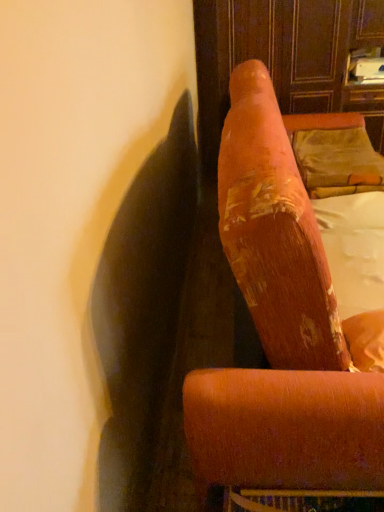
I want to click on white fabric at upper right, so click(354, 249).

From the image's perspective, who appears lower, velvet gold pillow at upper right or white fabric at upper right?

white fabric at upper right, from the image's perspective.

Is velvet gold pillow at upper right situated inside white fabric at upper right or outside?

The correct answer is: outside.

Relative to white fabric at upper right, is velvet gold pillow at upper right in front or behind?

velvet gold pillow at upper right is behind white fabric at upper right.

Identify the location of sheet that is below the velvet gold pillow at upper right (from the image's perspective). The width and height of the screenshot is (384, 512). (354, 249).

Considering the sizes of white fabric at upper right and velvet gold pillow at upper right in the image, is white fabric at upper right wider or thinner than velvet gold pillow at upper right?

Clearly, white fabric at upper right has less width compared to velvet gold pillow at upper right.

From the picture: Considering the sizes of objects white fabric at upper right and velvet gold pillow at upper right in the image provided, who is shorter, white fabric at upper right or velvet gold pillow at upper right?

white fabric at upper right is shorter.

The width and height of the screenshot is (384, 512). What are the coordinates of `sheet that is in front of the velvet gold pillow at upper right` in the screenshot? It's located at (354, 249).

Is the position of white fabric at upper right less distant than that of velvet gold pillow at upper right?

That is True.

From the image's perspective, is velvet orange armchair at upper right located beneath white fabric at upper right?

No.

In the image, there is a white fabric at upper right. What are the coordinates of `furniture above it (from the image's perspective)` in the screenshot? It's located at (284, 329).

Considering the relative sizes of velvet orange armchair at upper right and white fabric at upper right in the image provided, is velvet orange armchair at upper right bigger than white fabric at upper right?

Yes, velvet orange armchair at upper right is bigger than white fabric at upper right.

How different are the orientations of velvet orange armchair at upper right and velvet gold pillow at upper right in degrees?

velvet orange armchair at upper right and velvet gold pillow at upper right are facing 0.319 degrees away from each other.

Where is `pillow to the right of velvet orange armchair at upper right`? The height and width of the screenshot is (512, 384). pillow to the right of velvet orange armchair at upper right is located at coordinates (334, 154).

From the image's perspective, between velvet orange armchair at upper right and velvet gold pillow at upper right, which one is located above?

velvet gold pillow at upper right, from the image's perspective.

Is white fabric at upper right thinner than velvet orange armchair at upper right?

Yes, white fabric at upper right is thinner than velvet orange armchair at upper right.

Is the depth of white fabric at upper right greater than that of velvet orange armchair at upper right?

Yes, it is.

In the scene shown: Who is taller, white fabric at upper right or velvet orange armchair at upper right?

With more height is velvet orange armchair at upper right.

From a real-world perspective, does white fabric at upper right sit lower than velvet orange armchair at upper right?

Indeed, from a real-world perspective, white fabric at upper right is positioned beneath velvet orange armchair at upper right.

From the image's perspective, is velvet gold pillow at upper right located beneath velvet orange armchair at upper right?

No, from the image's perspective, velvet gold pillow at upper right is not beneath velvet orange armchair at upper right.

Is velvet gold pillow at upper right thinner than velvet orange armchair at upper right?

Yes, velvet gold pillow at upper right is thinner than velvet orange armchair at upper right.

Would you say velvet gold pillow at upper right is inside or outside velvet orange armchair at upper right?

velvet gold pillow at upper right is enclosed within velvet orange armchair at upper right.

In the image, is velvet gold pillow at upper right on the left side or the right side of velvet orange armchair at upper right?

Clearly, velvet gold pillow at upper right is on the right of velvet orange armchair at upper right in the image.

Identify the location of sheet on the left side of velvet gold pillow at upper right. The width and height of the screenshot is (384, 512). click(x=354, y=249).

Where is `pillow above the white fabric at upper right (from a real-world perspective)`? pillow above the white fabric at upper right (from a real-world perspective) is located at coordinates (334, 154).

Which object lies nearer to the anchor point velvet gold pillow at upper right, velvet orange armchair at upper right or white fabric at upper right?

The object closer to velvet gold pillow at upper right is white fabric at upper right.

Looking at the image, which one is located closer to white fabric at upper right, velvet gold pillow at upper right or velvet orange armchair at upper right?

velvet gold pillow at upper right lies closer to white fabric at upper right than the other object.

Considering their positions, is white fabric at upper right positioned further to velvet orange armchair at upper right than velvet gold pillow at upper right?

The object further to velvet orange armchair at upper right is velvet gold pillow at upper right.

Consider the image. From the image, which object appears to be nearer to velvet gold pillow at upper right, white fabric at upper right or velvet orange armchair at upper right?

The object closer to velvet gold pillow at upper right is white fabric at upper right.

Considering their positions, is velvet gold pillow at upper right positioned further to velvet orange armchair at upper right than white fabric at upper right?

velvet gold pillow at upper right is further to velvet orange armchair at upper right.

Estimate the real-world distances between objects in this image. Which object is closer to white fabric at upper right, velvet orange armchair at upper right or velvet gold pillow at upper right?

velvet gold pillow at upper right is positioned closer to the anchor white fabric at upper right.

Where is `sheet between velvet orange armchair at upper right and velvet gold pillow at upper right along the z-axis`? The width and height of the screenshot is (384, 512). sheet between velvet orange armchair at upper right and velvet gold pillow at upper right along the z-axis is located at coordinates (354, 249).